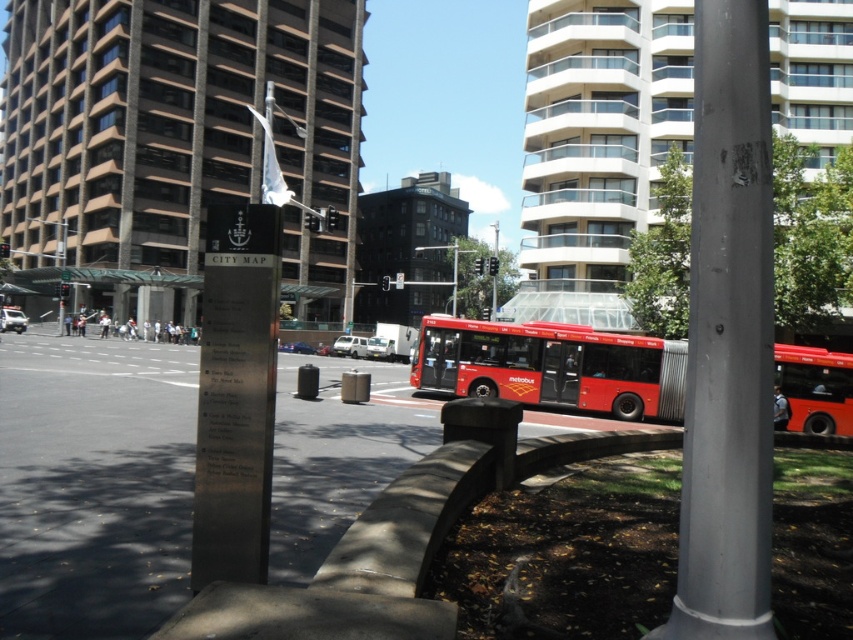
Question: Is gray metallic pole at center smaller than metallic red bus at center?

Choices:
 (A) no
 (B) yes

Answer: (B)

Question: Which point is farther from the camera taking this photo?

Choices:
 (A) (628, 419)
 (B) (762, 365)

Answer: (A)

Question: Is gray metallic pole at center to the right of metallic red bus at center from the viewer's perspective?

Choices:
 (A) yes
 (B) no

Answer: (B)

Question: Which object appears farthest from the camera in this image?

Choices:
 (A) metallic red bus at center
 (B) gray metallic pole at center

Answer: (A)

Question: Where is gray metallic pole at center located in relation to metallic red bus at center in the image?

Choices:
 (A) below
 (B) above

Answer: (B)